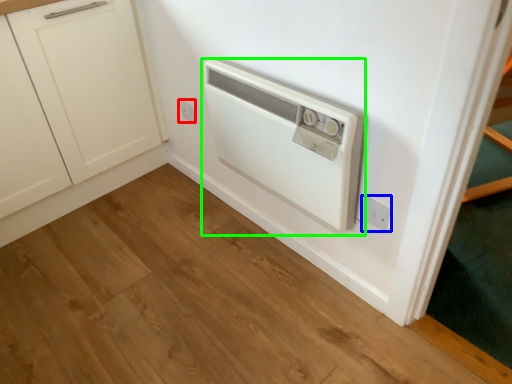
Question: Considering the real-world distances, which object is farthest from electric outlet (highlighted by a red box)? electric outlet (highlighted by a blue box) or home appliance (highlighted by a green box)?

Choices:
 (A) electric outlet
 (B) home appliance

Answer: (A)